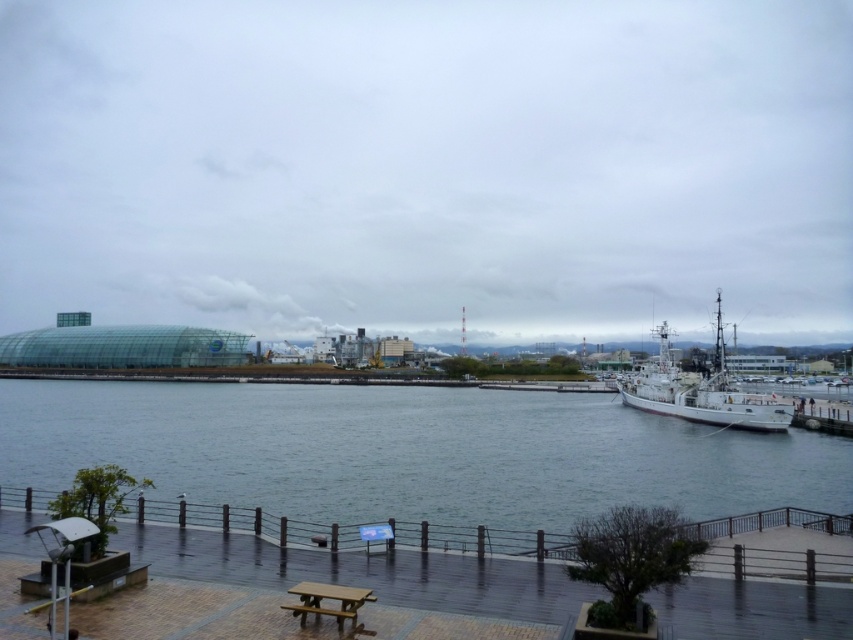
You are a photographer standing on the boardwalk and want to capture a photo of the blue water at center and the brown wooden bench at lower center. Which object appears larger in the photo?

The blue water at center appears larger in the photo because it is taller than the brown wooden bench at lower center.

You are standing on the brown wooden dock at lower center and looking towards the blue water at center. Which one appears taller from your perspective?

The blue water at center appears taller because it has a greater height compared to the brown wooden dock at lower center.